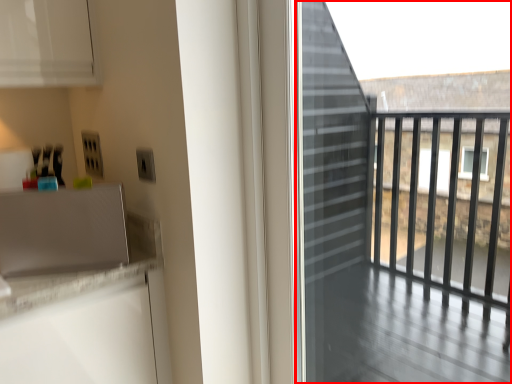
Question: Observing the image, what is the correct spatial positioning of screen door (annotated by the red box) in reference to appliance?

Choices:
 (A) left
 (B) right

Answer: (B)